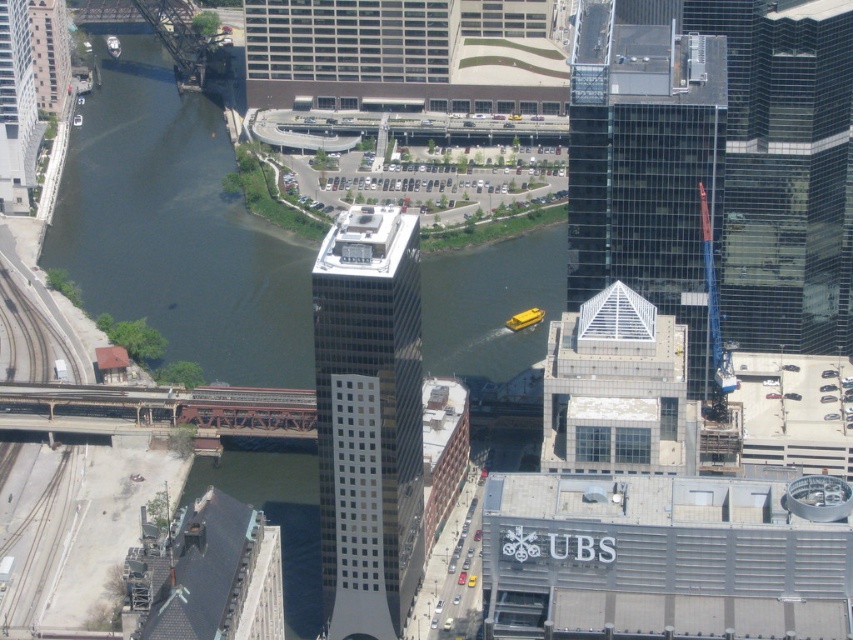
Question: Is transparent glass skyscraper at center wider than metallic glass skyscraper at center?

Choices:
 (A) no
 (B) yes

Answer: (B)

Question: Does dark green water at left appear on the right side of metallic glass skyscraper at center?

Choices:
 (A) no
 (B) yes

Answer: (A)

Question: Is transparent glass skyscraper at center above metallic glass skyscraper at center?

Choices:
 (A) yes
 (B) no

Answer: (A)

Question: Among these objects, which one is nearest to the camera?

Choices:
 (A) metallic glass skyscraper at center
 (B) dark green water at left

Answer: (A)

Question: Which point appears farthest from the camera in this image?

Choices:
 (A) (305, 518)
 (B) (634, 250)

Answer: (A)

Question: Which point is farther to the camera?

Choices:
 (A) (276, 326)
 (B) (579, 305)
 (C) (407, 289)

Answer: (A)